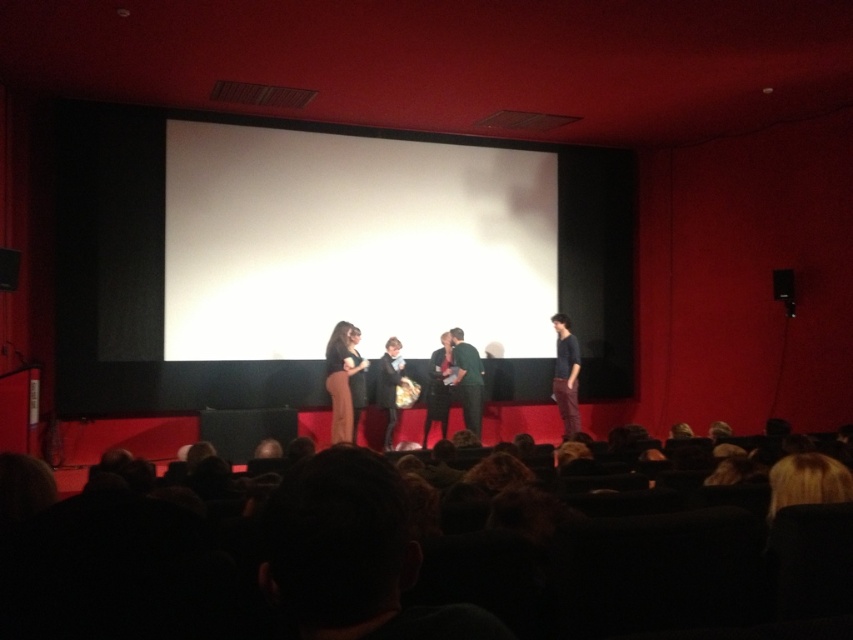
Which of these two, matte black dress at center or velvet black coat at center, stands shorter?

With less height is matte black dress at center.

Which is in front, point (351, 406) or point (392, 412)?

Point (351, 406) is in front.

You are a GUI agent. You are given a task and a screenshot of the screen. Output one action in this format:
    pyautogui.click(x=<x>, y=<y>)
    Task: Click on the matte black dress at center
    
    Given the screenshot: What is the action you would take?
    pyautogui.click(x=340, y=381)

Can you confirm if matte black dress at center is shorter than green fabric dress at center?

Yes.

Is matte black dress at center thinner than green fabric dress at center?

No.

Measure the distance between matte black dress at center and camera.

matte black dress at center is 6.69 meters away from camera.

Where is `matte black dress at center`? matte black dress at center is located at coordinates (340, 381).

Is green matte shirt at center shorter than green fabric dress at center?

Correct, green matte shirt at center is not as tall as green fabric dress at center.

Which is more to the right, green matte shirt at center or green fabric dress at center?

green matte shirt at center

What do you see at coordinates (467, 380) in the screenshot?
I see `green matte shirt at center` at bounding box center [467, 380].

I want to click on green matte shirt at center, so click(467, 380).